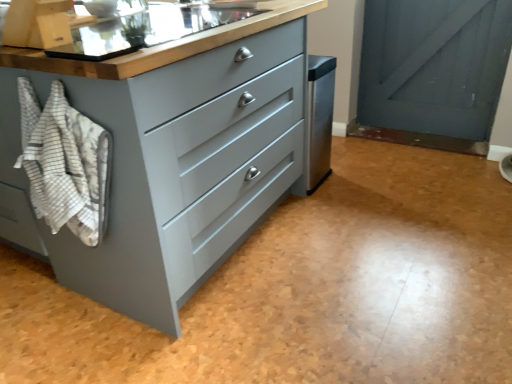
Question: Can you confirm if white striped towel at left is bigger than matte gray chest of drawers at center?

Choices:
 (A) no
 (B) yes

Answer: (A)

Question: Can you confirm if white striped towel at left is shorter than matte gray chest of drawers at center?

Choices:
 (A) yes
 (B) no

Answer: (A)

Question: Would you say white striped towel at left is a long distance from matte gray chest of drawers at center?

Choices:
 (A) no
 (B) yes

Answer: (A)

Question: Does white striped towel at left have a greater width compared to matte gray chest of drawers at center?

Choices:
 (A) yes
 (B) no

Answer: (B)

Question: Does white striped towel at left come behind matte gray chest of drawers at center?

Choices:
 (A) yes
 (B) no

Answer: (A)

Question: Is matte stainless steel sink at upper center to the left or to the right of matte gray chest of drawers at center in the image?

Choices:
 (A) left
 (B) right

Answer: (A)

Question: Is matte stainless steel sink at upper center bigger or smaller than matte gray chest of drawers at center?

Choices:
 (A) small
 (B) big

Answer: (A)

Question: In terms of height, does matte stainless steel sink at upper center look taller or shorter compared to matte gray chest of drawers at center?

Choices:
 (A) short
 (B) tall

Answer: (A)

Question: From a real-world perspective, is matte stainless steel sink at upper center positioned above or below matte gray chest of drawers at center?

Choices:
 (A) below
 (B) above

Answer: (B)

Question: From a real-world perspective, relative to matte gray chest of drawers at center, is white striped towel at left vertically above or below?

Choices:
 (A) above
 (B) below

Answer: (A)

Question: Relative to matte gray chest of drawers at center, is white striped towel at left in front or behind?

Choices:
 (A) behind
 (B) front

Answer: (A)

Question: From the image's perspective, relative to matte gray chest of drawers at center, is white striped towel at left above or below?

Choices:
 (A) below
 (B) above

Answer: (A)

Question: In terms of width, does white striped towel at left look wider or thinner when compared to matte gray chest of drawers at center?

Choices:
 (A) wide
 (B) thin

Answer: (B)

Question: Is matte stainless steel sink at upper center taller or shorter than white striped towel at left?

Choices:
 (A) tall
 (B) short

Answer: (B)

Question: Considering the positions of matte stainless steel sink at upper center and white striped towel at left in the image, is matte stainless steel sink at upper center wider or thinner than white striped towel at left?

Choices:
 (A) thin
 (B) wide

Answer: (B)